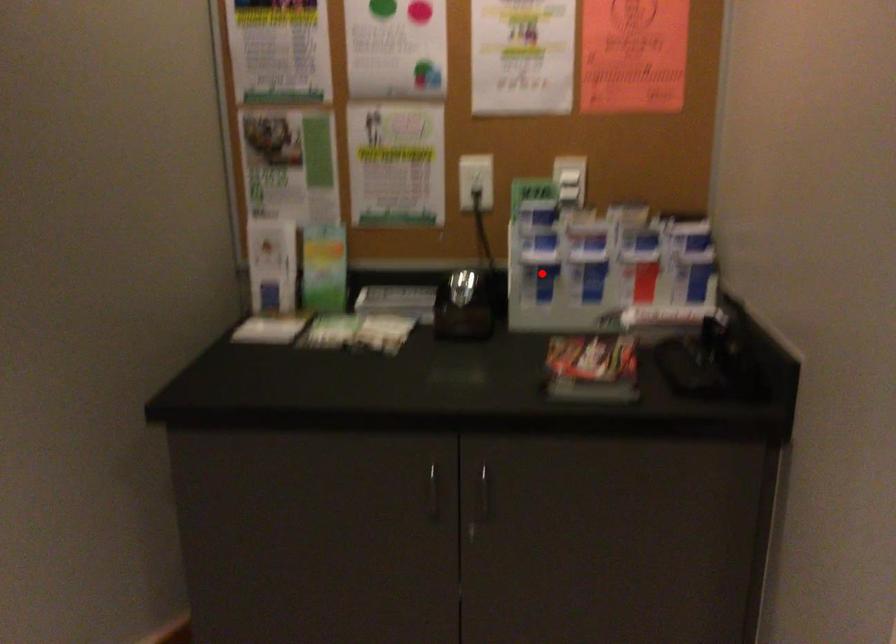
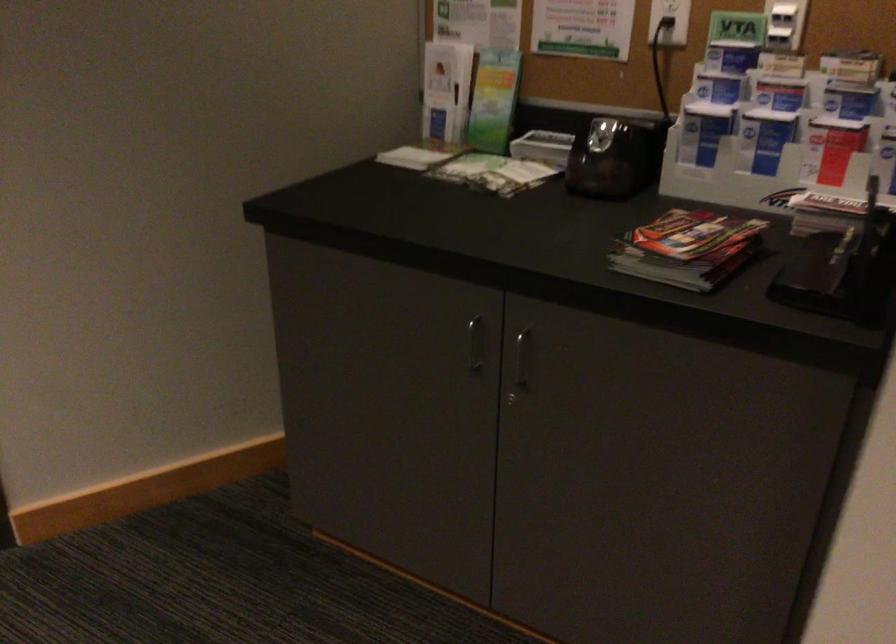
Question: I am providing you with two images of the same scene from different viewpoints. Given a red point in image1, look at the same physical point in image2. Is it:

Choices:
 (A) Closer to the viewpoint
 (B) Farther from the viewpoint

Answer: (A)